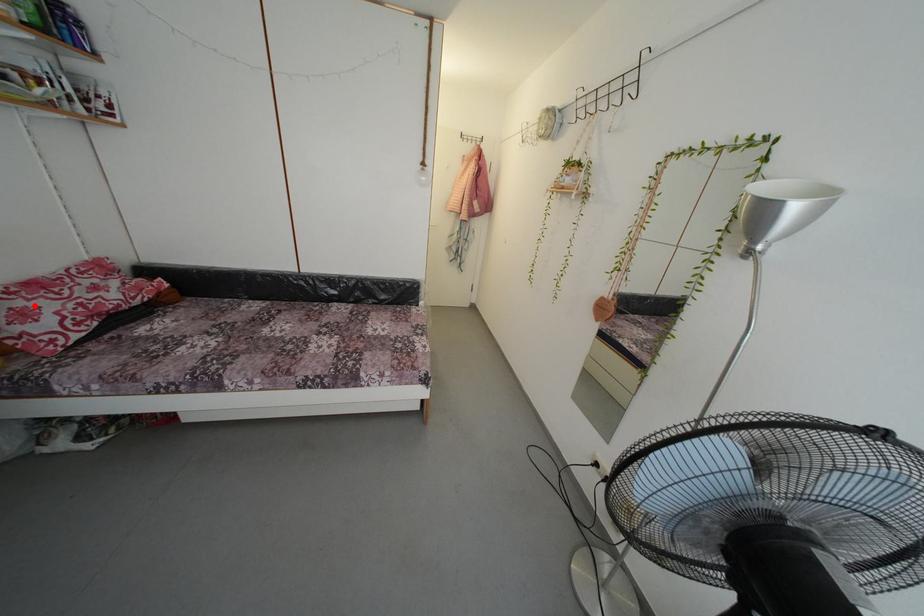
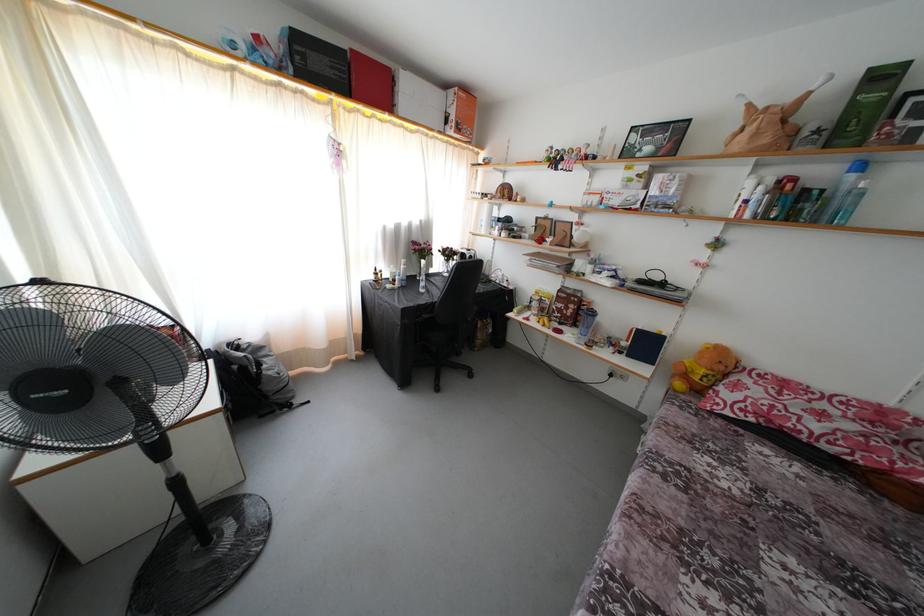
Question: I am providing you with two images of the same scene from different viewpoints. Given a red point in image1, look at the same physical point in image2. Is it:

Choices:
 (A) Closer to the viewpoint
 (B) Farther from the viewpoint

Answer: (A)